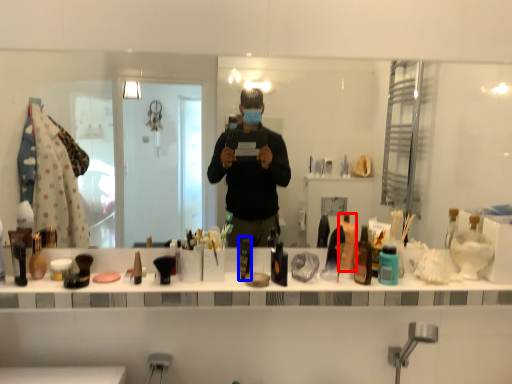
Question: Which object appears closest to the camera in this image, toiletry (highlighted by a red box) or toiletry (highlighted by a blue box)?

Choices:
 (A) toiletry
 (B) toiletry

Answer: (B)